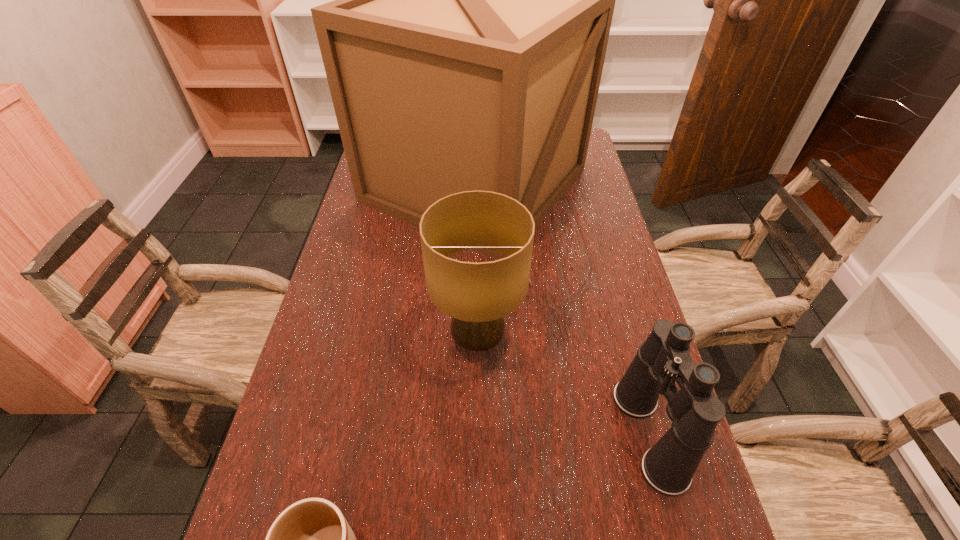
I want to click on object that can be found as the second closest to the shortest object, so click(x=664, y=358).

This screenshot has width=960, height=540. Identify the location of vacant space that satisfies the following two spatial constraints: 1. on the front side of the second nearest object; 2. on the right side of the box. (471, 434).